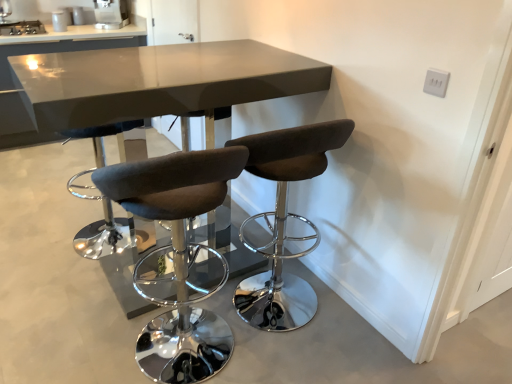
Question: Is the depth of stainless steel stove at upper left, the 2th appliance when ordered from right to left, less than that of matte gray table at center, which is counted as the second table, starting from the back?

Choices:
 (A) no
 (B) yes

Answer: (A)

Question: From the image's perspective, is stainless steel stove at upper left, the 1th appliance in the bottom-to-top sequence, on matte gray table at center, which is the first table from front to back?

Choices:
 (A) no
 (B) yes

Answer: (B)

Question: Does stainless steel stove at upper left, acting as the 2th appliance starting from the top, have a lesser width compared to matte gray table at center, the first table from the right?

Choices:
 (A) no
 (B) yes

Answer: (B)

Question: Would you say stainless steel stove at upper left, acting as the 2th appliance starting from the top, contains matte gray table at center, the 2th table viewed from the left?

Choices:
 (A) no
 (B) yes

Answer: (A)

Question: Does stainless steel stove at upper left, which is the first appliance in left-to-right order, have a greater height compared to matte gray table at center, which is counted as the second table, starting from the back?

Choices:
 (A) no
 (B) yes

Answer: (A)

Question: Is stainless steel stove at upper left, the 1th appliance in the bottom-to-top sequence, oriented towards matte gray table at center, the 2th table viewed from the left?

Choices:
 (A) no
 (B) yes

Answer: (B)

Question: Considering the relative positions of satin silver coffee machine at upper center, positioned as the first appliance in top-to-bottom order, and matte gray table at center, which is the first table from front to back, in the image provided, is satin silver coffee machine at upper center, positioned as the first appliance in top-to-bottom order, in front of matte gray table at center, which is the first table from front to back,?

Choices:
 (A) yes
 (B) no

Answer: (B)

Question: Is satin silver coffee machine at upper center, placed as the second appliance when sorted from left to right, not inside matte gray table at center, which is counted as the second table, starting from the back?

Choices:
 (A) no
 (B) yes

Answer: (B)

Question: Is satin silver coffee machine at upper center, which is the 2th appliance in bottom-to-top order, to the right of matte gray table at center, which is counted as the second table, starting from the back, from the viewer's perspective?

Choices:
 (A) yes
 (B) no

Answer: (B)

Question: From a real-world perspective, is satin silver coffee machine at upper center, positioned as the first appliance in top-to-bottom order, on matte gray table at center, which is counted as the second table, starting from the back?

Choices:
 (A) yes
 (B) no

Answer: (A)

Question: Does satin silver coffee machine at upper center, which is the 2th appliance in bottom-to-top order, turn towards matte gray table at center, the first table from the right?

Choices:
 (A) no
 (B) yes

Answer: (A)

Question: Are satin silver coffee machine at upper center, arranged as the 1th appliance when viewed from the right, and matte gray table at center, the first table from the right, beside each other?

Choices:
 (A) yes
 (B) no

Answer: (B)

Question: Does brown fabric stool at center, the second chair in the left-to-right sequence, come behind dark gray fabric stool at center, arranged as the 1th chair when viewed from the left?

Choices:
 (A) no
 (B) yes

Answer: (B)